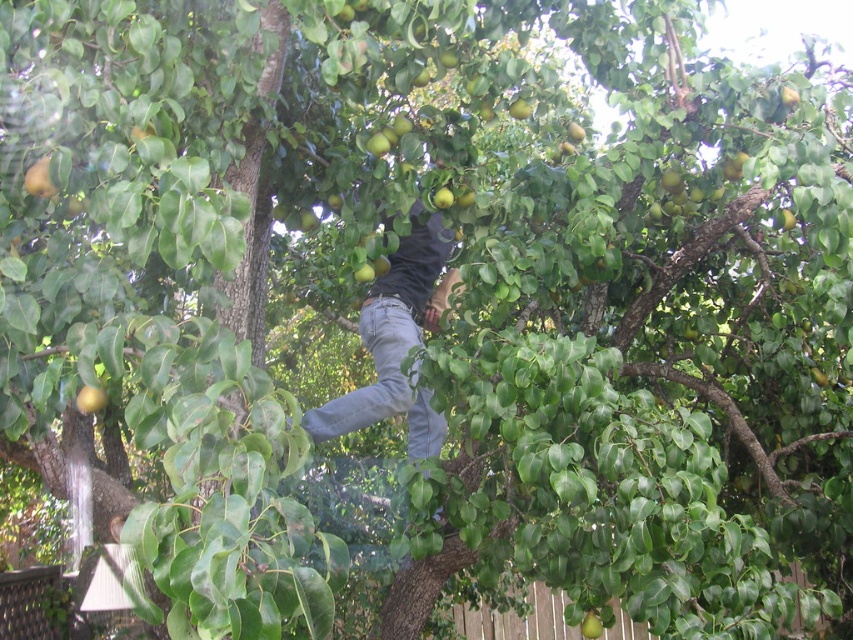
Can you confirm if denim jeans at center is wider than green matte apple at lower left?

Indeed, denim jeans at center has a greater width compared to green matte apple at lower left.

Can you confirm if denim jeans at center is positioned to the right of green matte apple at lower left?

Yes, denim jeans at center is to the right of green matte apple at lower left.

The width and height of the screenshot is (853, 640). What are the coordinates of `denim jeans at center` in the screenshot? It's located at (396, 340).

The width and height of the screenshot is (853, 640). In order to click on denim jeans at center in this screenshot , I will do pos(396,340).

Which of these two, green matte apple at upper left or green matte apple at center, stands taller?

With more height is green matte apple at upper left.

Is green matte apple at upper left below green matte apple at center?

No, green matte apple at upper left is not below green matte apple at center.

Who is more distant from viewer, (30, 192) or (598, 625)?

The point (598, 625) is behind.

Find the location of a particular element. The image size is (853, 640). green matte apple at upper left is located at coordinates click(39, 179).

Is denim jeans at center positioned behind green matte apple at center?

That is True.

Does denim jeans at center appear under green matte apple at center?

No, denim jeans at center is not below green matte apple at center.

The image size is (853, 640). Find the location of `denim jeans at center`. denim jeans at center is located at coordinates (396, 340).